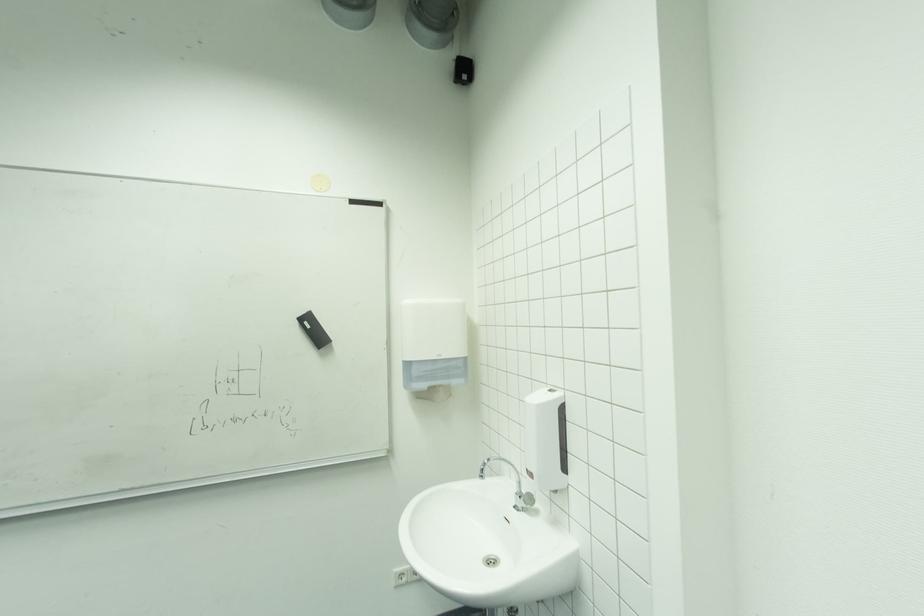
At what (x,y) coordinates should I click in order to perform the action: click on soap dispenser panel. Please return your answer as a coordinate pair (x, y). Looking at the image, I should click on (545, 439).